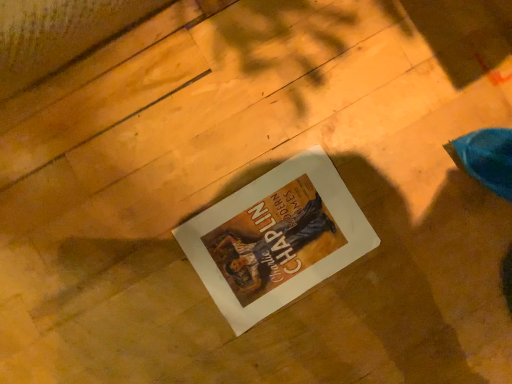
At what (x,y) coordinates should I click in order to perform the action: click on vacant space underneath matte paper poster at center (from a real-world perspective). Please return your answer as a coordinate pair (x, y). The height and width of the screenshot is (384, 512). Looking at the image, I should click on (269, 246).